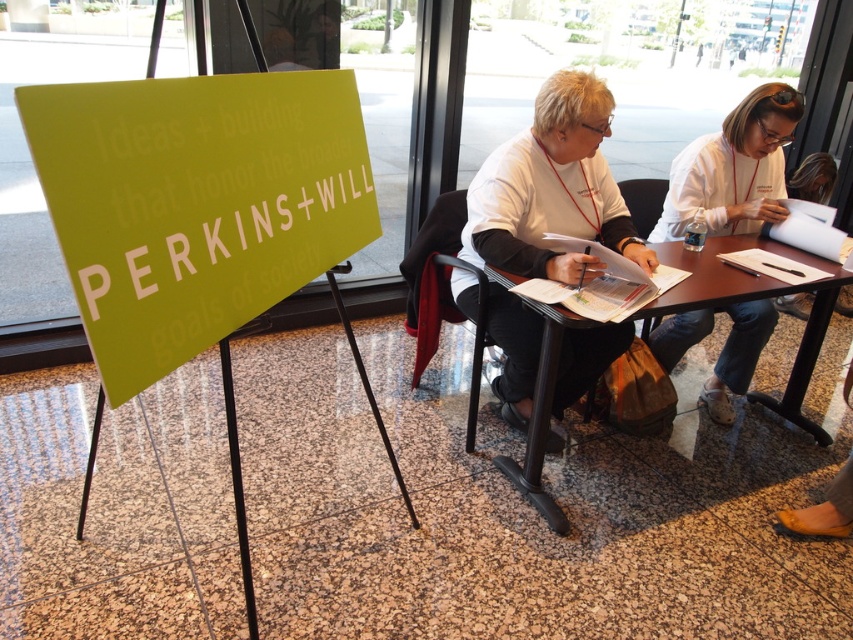
Question: Which point is farther from the camera taking this photo?

Choices:
 (A) (802, 346)
 (B) (732, 204)

Answer: (A)

Question: Is white matte shirt at center closer to camera compared to black plastic chair at center?

Choices:
 (A) no
 (B) yes

Answer: (B)

Question: Can you confirm if green matte sign at left is wider than brown wooden table at center?

Choices:
 (A) yes
 (B) no

Answer: (B)

Question: Which point is farther from the camera taking this photo?

Choices:
 (A) (556, 214)
 (B) (631, 180)
 (C) (708, 410)
 (D) (548, 372)

Answer: (B)

Question: Can you confirm if green matte sign at left is bigger than white fabric shirt at upper right?

Choices:
 (A) yes
 (B) no

Answer: (A)

Question: Which object appears closest to the camera in this image?

Choices:
 (A) white fabric shirt at upper right
 (B) white matte shirt at center
 (C) green matte sign at left
 (D) brown wooden table at center

Answer: (C)